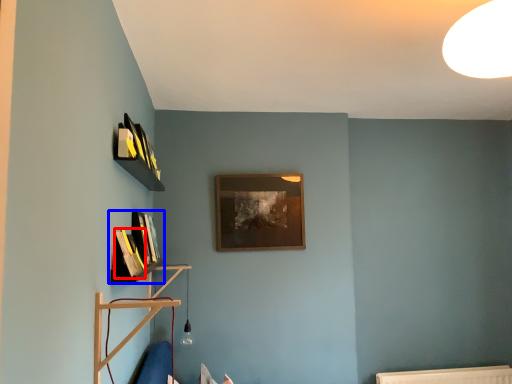
Question: Which of the following is the farthest to the observer, book (highlighted by a red box) or shelf (highlighted by a blue box)?

Choices:
 (A) book
 (B) shelf

Answer: (A)